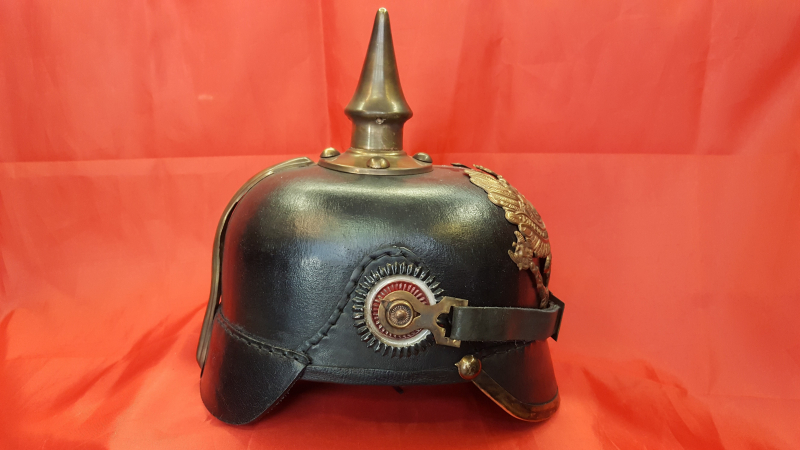
Locate an element on the screen. This screenshot has width=800, height=450. tablecloth is located at coordinates (530, 114).